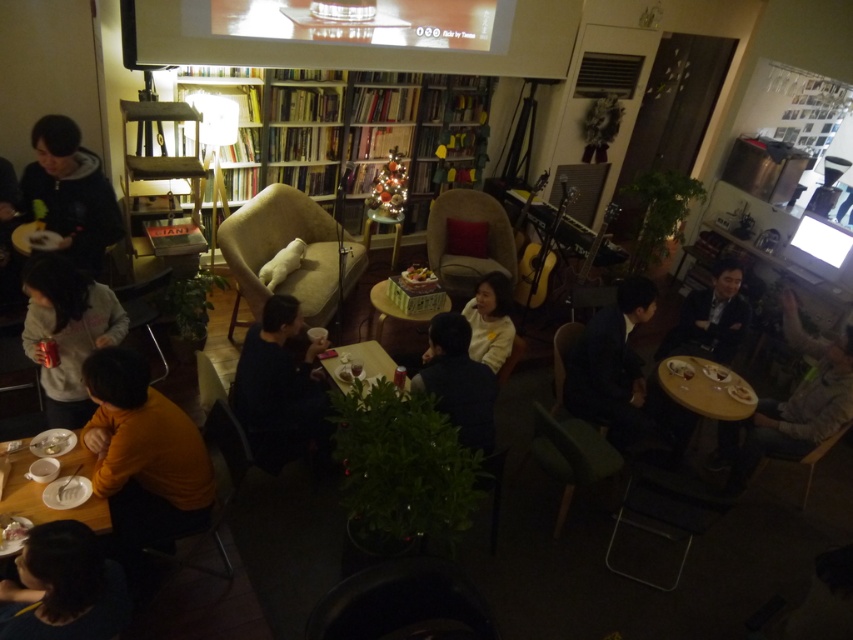
Question: Does dark gray hoodie at left appear on the right side of dark blue suit at center?

Choices:
 (A) no
 (B) yes

Answer: (A)

Question: Which object is farther from the camera taking this photo?

Choices:
 (A) dark gray hoodie at left
 (B) light gray hoodie at lower left
 (C) dark suit at right

Answer: (C)

Question: Does wooden bookshelf at center come in front of gray knit sweater at right?

Choices:
 (A) no
 (B) yes

Answer: (A)

Question: Estimate the real-world distances between objects in this image. Which object is closer to the white glossy table at lower left?

Choices:
 (A) wooden table at center
 (B) dark blue sweater at center
 (C) dark blue sweater at lower center
 (D) dark suit at right

Answer: (C)

Question: Can you confirm if light gray hoodie at lower left is positioned above dark suit at right?

Choices:
 (A) yes
 (B) no

Answer: (B)

Question: Which point appears farthest from the camera in this image?

Choices:
 (A) (688, 387)
 (B) (463, 364)
 (C) (88, 204)

Answer: (A)